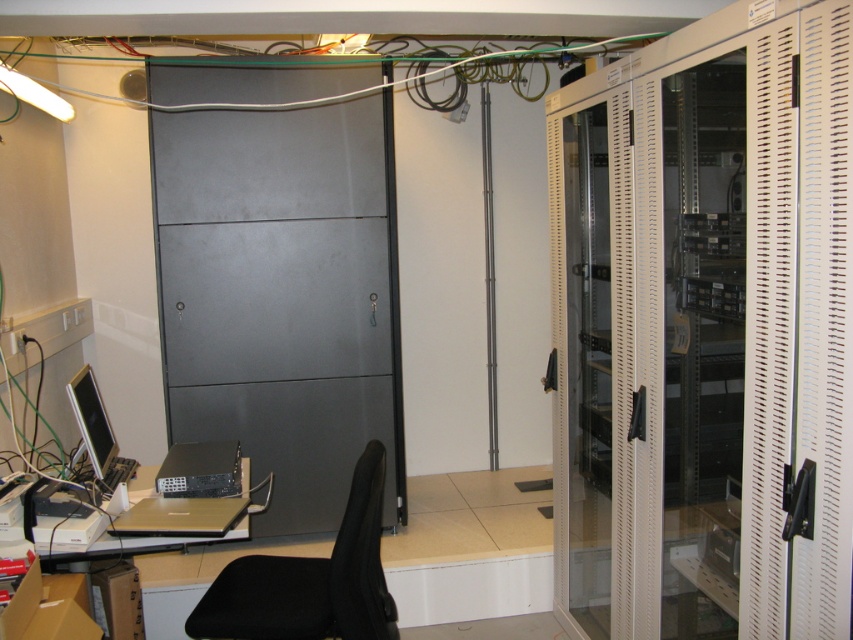
Question: Does black fabric swivel chair at lower center appear over matte black desk at lower left?

Choices:
 (A) no
 (B) yes

Answer: (A)

Question: Which of the following is the farthest from the observer?

Choices:
 (A) (198, 317)
 (B) (264, 577)
 (C) (79, 380)
 (D) (817, 616)

Answer: (A)

Question: Based on their relative distances, which object is farther from the beige perforated locker at right?

Choices:
 (A) matte black monitor at left
 (B) matte black desk at lower left
 (C) black fabric swivel chair at lower center

Answer: (A)

Question: Is beige perforated locker at right further to the viewer compared to matte black desk at lower left?

Choices:
 (A) yes
 (B) no

Answer: (B)

Question: Considering the real-world distances, which object is closest to the metallic gray locker at center?

Choices:
 (A) matte black desk at lower left
 (B) matte black monitor at left
 (C) black fabric swivel chair at lower center

Answer: (B)

Question: Can you confirm if black fabric swivel chair at lower center is positioned above matte black monitor at left?

Choices:
 (A) no
 (B) yes

Answer: (A)